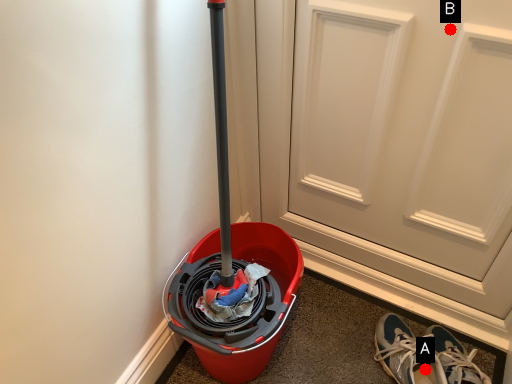
Question: Two points are circled on the image, labeled by A and B beside each circle. Which point is farther from the camera taking this photo?

Choices:
 (A) A is further
 (B) B is further

Answer: (A)